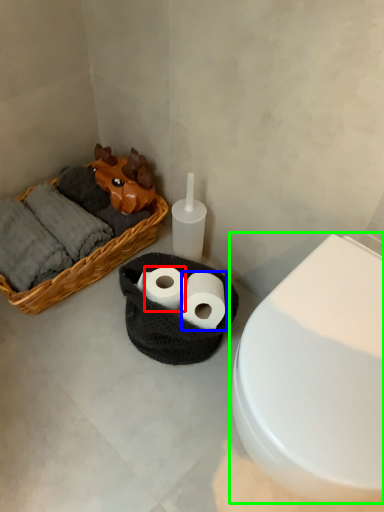
Question: Which is nearer to the toilet paper (highlighted by a red box)? toilet paper (highlighted by a blue box) or toilet (highlighted by a green box).

Choices:
 (A) toilet paper
 (B) toilet

Answer: (A)